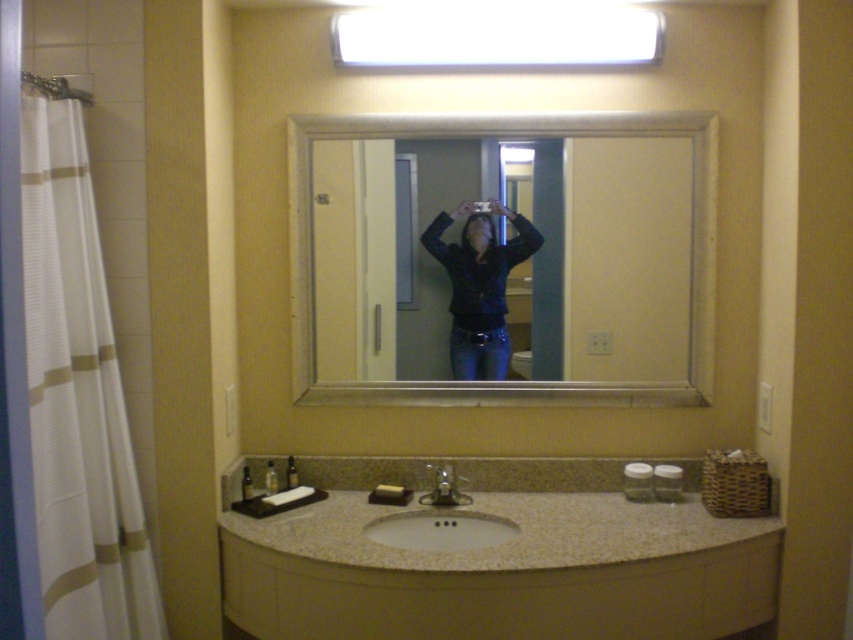
You are standing in the bathroom and want to place a new towel on the vanity countertop. The current items on the countertop include the small basket containing toiletries or personal care products, a couple of jars, and the white textured fabric at left marked by point (77, 397). Where should you place the new towel to avoid covering any existing items?

Place the new towel away from the white textured fabric at left marked by point (77, 397) and the other items on the countertop to avoid covering them.

You are standing in the bathroom and want to place a 5 foot long decorative rod between the white textured fabric at left and the mirror. Is there enough space?

The distance between the white textured fabric at left and the mirror is 4.95 feet, which is slightly less than the 5 foot long rod. Therefore, the rod would not fit between them.

You are standing in the bathroom and want to reach the two points marked in the image. Which point, point (x=305, y=198) or point (x=509, y=266), is closer to you?

Point (x=305, y=198) is closer to the viewer than point (x=509, y=266).